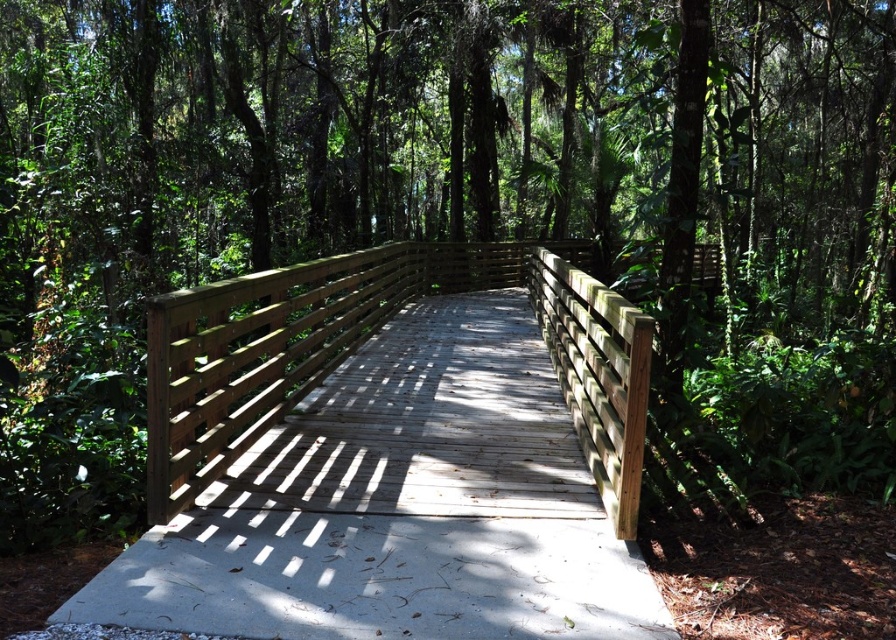
Can you confirm if wooden bridge at center is positioned to the left of natural wood fence at center?

A: Indeed, wooden bridge at center is positioned on the left side of natural wood fence at center.

Between point (226, 384) and point (633, 348), which one is positioned in front?

Point (633, 348)

Where is `wooden bridge at center`? wooden bridge at center is located at coordinates (365, 340).